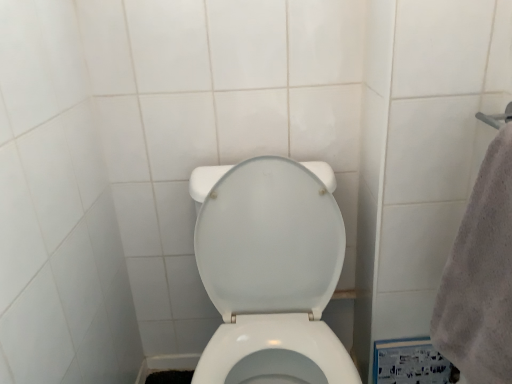
Question: Is white glossy toilet at center taller or shorter than gray fluffy towel at right?

Choices:
 (A) tall
 (B) short

Answer: (A)

Question: Looking at the image, does white glossy toilet at center seem bigger or smaller compared to gray fluffy towel at right?

Choices:
 (A) big
 (B) small

Answer: (A)

Question: Is white glossy toilet at center inside the boundaries of gray fluffy towel at right, or outside?

Choices:
 (A) outside
 (B) inside

Answer: (A)

Question: Is gray fluffy towel at right in front of or behind white glossy toilet at center in the image?

Choices:
 (A) behind
 (B) front

Answer: (B)

Question: From a real-world perspective, is gray fluffy towel at right physically located above or below white glossy toilet at center?

Choices:
 (A) below
 (B) above

Answer: (B)

Question: Would you say gray fluffy towel at right is inside or outside white glossy toilet at center?

Choices:
 (A) outside
 (B) inside

Answer: (A)

Question: Is gray fluffy towel at right bigger or smaller than white glossy toilet at center?

Choices:
 (A) small
 (B) big

Answer: (A)